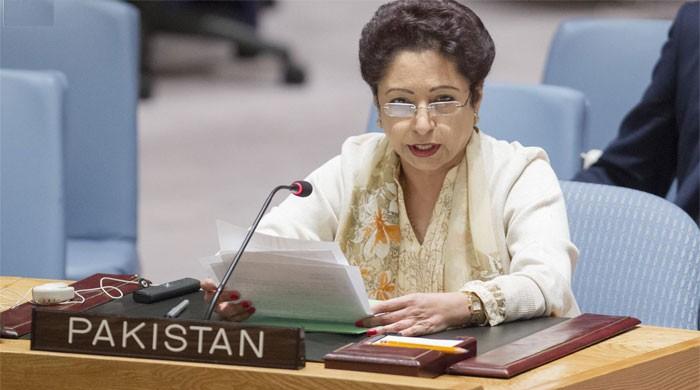
In order to click on desk in this screenshot , I will do `click(620, 352)`.